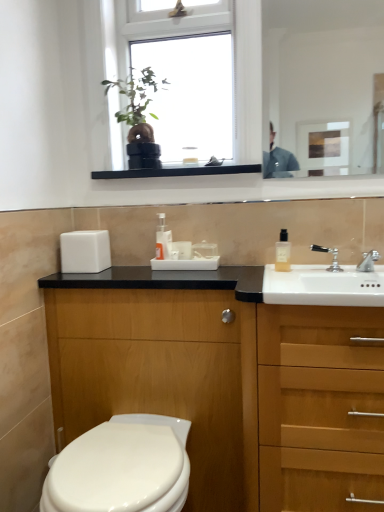
Question: Does white glossy mirror at upper right come in front of silver metallic faucet at sink right, placed as the 1th tap when sorted from left to right?

Choices:
 (A) no
 (B) yes

Answer: (B)

Question: Can you confirm if white glossy mirror at upper right is thinner than silver metallic faucet at sink right, which is the second tap in right-to-left order?

Choices:
 (A) yes
 (B) no

Answer: (A)

Question: From a real-world perspective, does white glossy mirror at upper right stand above silver metallic faucet at sink right, placed as the 1th tap when sorted from left to right?

Choices:
 (A) yes
 (B) no

Answer: (A)

Question: Considering the relative positions of white glossy mirror at upper right and silver metallic faucet at sink right, which is the second tap in right-to-left order, in the image provided, is white glossy mirror at upper right to the left of silver metallic faucet at sink right, which is the second tap in right-to-left order, from the viewer's perspective?

Choices:
 (A) yes
 (B) no

Answer: (A)

Question: Could you tell me if white glossy mirror at upper right is turned towards silver metallic faucet at sink right, which is the second tap in right-to-left order?

Choices:
 (A) no
 (B) yes

Answer: (A)

Question: From a real-world perspective, is white glossy mirror at upper right located beneath silver metallic faucet at sink right, which is the second tap in right-to-left order?

Choices:
 (A) yes
 (B) no

Answer: (B)

Question: Is wooden drawer at right wider than translucent plastic soap dispenser at center, which appears as the first toiletry when viewed from the left?

Choices:
 (A) no
 (B) yes

Answer: (B)

Question: Is the depth of wooden drawer at right less than that of translucent plastic soap dispenser at center, marked as the first toiletry in a back-to-front arrangement?

Choices:
 (A) no
 (B) yes

Answer: (B)

Question: From a real-world perspective, is wooden drawer at right positioned under translucent plastic soap dispenser at center, which appears as the first toiletry when viewed from the left, based on gravity?

Choices:
 (A) no
 (B) yes

Answer: (B)

Question: Can you confirm if wooden drawer at right is bigger than translucent plastic soap dispenser at center, positioned as the second toiletry in front-to-back order?

Choices:
 (A) yes
 (B) no

Answer: (A)

Question: From the image's perspective, does wooden drawer at right appear higher than translucent plastic soap dispenser at center, which appears as the first toiletry when viewed from the left?

Choices:
 (A) yes
 (B) no

Answer: (B)

Question: Would you consider wooden drawer at right to be distant from translucent plastic soap dispenser at center, positioned as the second toiletry in front-to-back order?

Choices:
 (A) yes
 (B) no

Answer: (B)

Question: Considering the relative sizes of wooden cabinet at right and clear glass bottle at upper right, the second toiletry viewed from the back, in the image provided, is wooden cabinet at right wider than clear glass bottle at upper right, the second toiletry viewed from the back,?

Choices:
 (A) no
 (B) yes

Answer: (B)